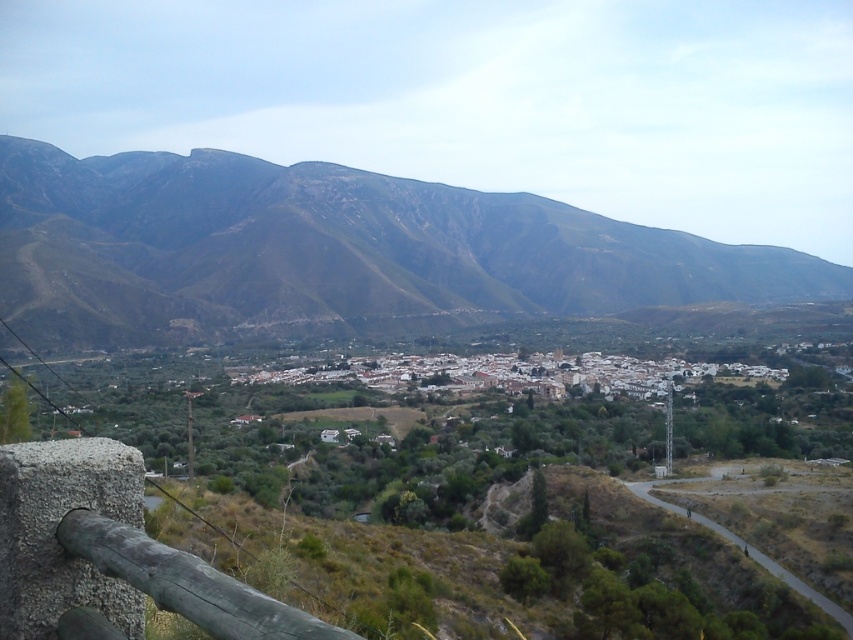
You are standing at the viewpoint and want to take a photo that includes both the green textured mountain at upper left and the weathered wood rail at lower left. Based on their positions, which object should you adjust your camera to focus on first to ensure both are in the frame?

The green textured mountain at upper left is positioned on the right side of weathered wood rail at lower left, so you should focus on the weathered wood rail at lower left first to ensure both are included in the frame.